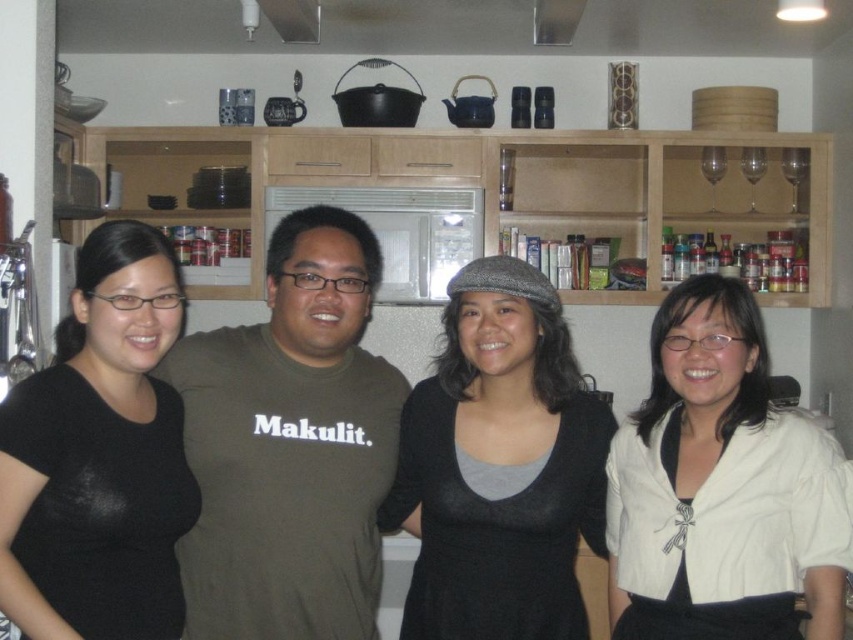
Question: Among these points, which one is farthest from the camera?

Choices:
 (A) (672, 320)
 (B) (444, 609)
 (C) (61, 529)

Answer: (A)

Question: Which object is farther from the camera taking this photo?

Choices:
 (A) white satin blouse at right
 (B) dark gray woolen hat at center

Answer: (B)

Question: Is dark gray woolen hat at center behind black matte shirt at left?

Choices:
 (A) yes
 (B) no

Answer: (A)

Question: Which of the following is the closest to the observer?

Choices:
 (A) dark green t-shirt at center
 (B) black matte shirt at left
 (C) dark gray woolen hat at center
 (D) white satin blouse at right

Answer: (B)

Question: From the image, what is the correct spatial relationship of dark green t-shirt at center in relation to white satin blouse at right?

Choices:
 (A) below
 (B) above

Answer: (B)

Question: Can you confirm if dark gray woolen hat at center is positioned to the left of black matte shirt at left?

Choices:
 (A) yes
 (B) no

Answer: (B)